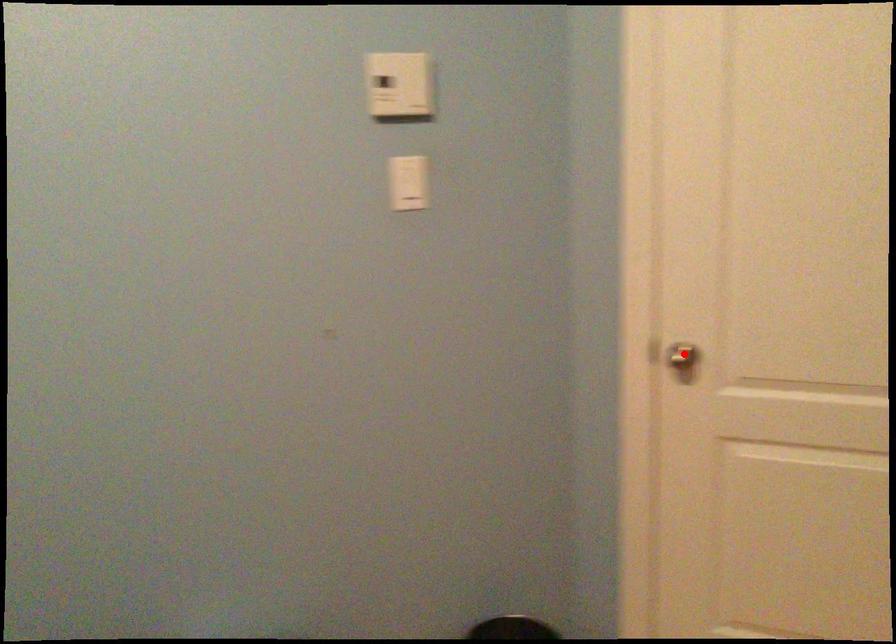
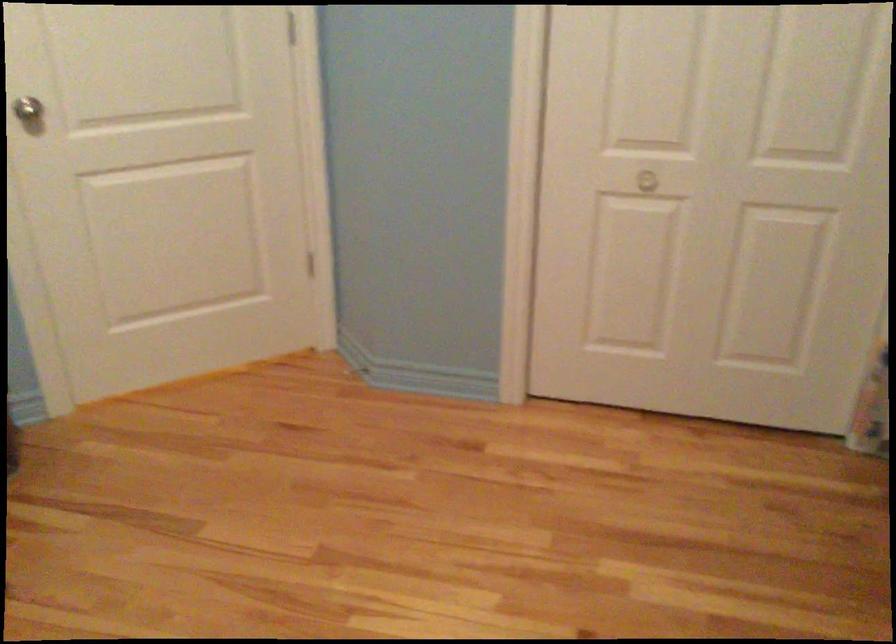
Where in the second image is the point corresponding to the highlighted location from the first image?

(29, 111)